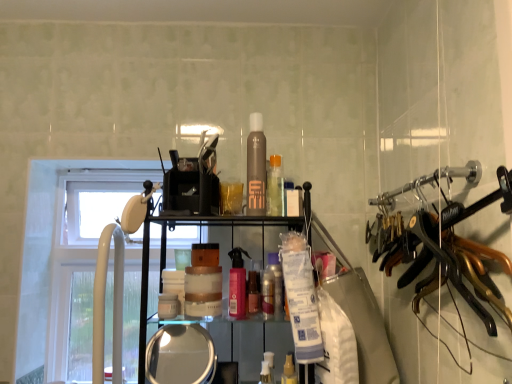
Question: Considering the relative sizes of translucent plastic spray bottle at center, positioned as the sixth toiletry in left-to-right order, and clear glass mirror at lower center in the image provided, is translucent plastic spray bottle at center, positioned as the sixth toiletry in left-to-right order, smaller than clear glass mirror at lower center?

Choices:
 (A) no
 (B) yes

Answer: (B)

Question: From the image's perspective, is translucent plastic spray bottle at center, positioned as the sixth toiletry in left-to-right order, on clear glass mirror at lower center?

Choices:
 (A) yes
 (B) no

Answer: (B)

Question: Can you confirm if translucent plastic spray bottle at center, which is the second toiletry from right to left, is bigger than clear glass mirror at lower center?

Choices:
 (A) no
 (B) yes

Answer: (A)

Question: Does translucent plastic spray bottle at center, positioned as the sixth toiletry in left-to-right order, have a lesser width compared to clear glass mirror at lower center?

Choices:
 (A) yes
 (B) no

Answer: (A)

Question: From a real-world perspective, is translucent plastic spray bottle at center, which is the second toiletry from right to left, below clear glass mirror at lower center?

Choices:
 (A) no
 (B) yes

Answer: (B)

Question: From the image's perspective, is translucent plastic spray bottle at center, which is the second toiletry from right to left, located beneath clear glass mirror at lower center?

Choices:
 (A) yes
 (B) no

Answer: (A)

Question: Is white plastic window at left smaller than translucent plastic bottle at center, which is counted as the third toiletry, starting from the right?

Choices:
 (A) no
 (B) yes

Answer: (A)

Question: Can you confirm if white plastic window at left is positioned to the right of translucent plastic bottle at center, which is counted as the third toiletry, starting from the right?

Choices:
 (A) yes
 (B) no

Answer: (B)

Question: Can you confirm if white plastic window at left is thinner than translucent plastic bottle at center, which is counted as the third toiletry, starting from the right?

Choices:
 (A) no
 (B) yes

Answer: (A)

Question: Can you confirm if white plastic window at left is bigger than translucent plastic bottle at center, the fifth toiletry viewed from the left?

Choices:
 (A) yes
 (B) no

Answer: (A)

Question: From the image's perspective, is white plastic window at left under translucent plastic bottle at center, the fifth toiletry viewed from the left?

Choices:
 (A) yes
 (B) no

Answer: (A)

Question: Is white plastic window at left aimed at translucent plastic bottle at center, the fifth toiletry viewed from the left?

Choices:
 (A) yes
 (B) no

Answer: (B)

Question: Can you confirm if white plastic window at left is shorter than clear glass mirror at lower center?

Choices:
 (A) no
 (B) yes

Answer: (A)